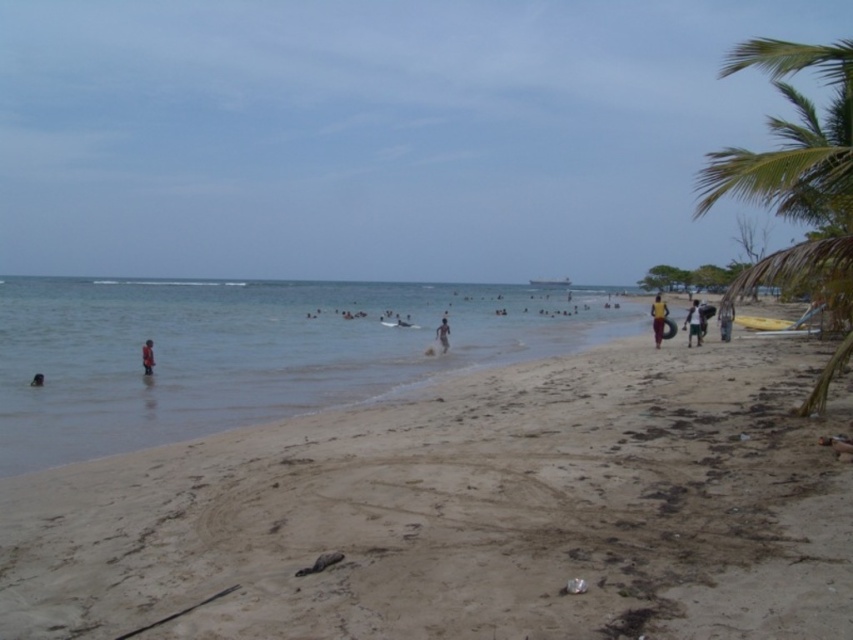
Question: Can you confirm if orange fabric person at lower left is smaller than dark skin human at lower left?

Choices:
 (A) yes
 (B) no

Answer: (B)

Question: Estimate the real-world distances between objects in this image. Which object is closer to the brown leather surfboard at lower right?

Choices:
 (A) orange fabric person at lower left
 (B) dark blue fabric shorts at center-right

Answer: (A)

Question: Which object is positioned closest to the orange fabric person at lower left?

Choices:
 (A) brown fabric person at right
 (B) green leafy palm tree at right
 (C) dark blue fabric shorts at center-right

Answer: (C)

Question: Estimate the real-world distances between objects in this image. Which object is farther from the dark skin human at lower left?

Choices:
 (A) green leafy palm tree at right
 (B) light brown sand at center
 (C) brown leather surfboard at lower right
 (D) clear blue water at beach center

Answer: (A)

Question: Where is brown sandy beach at lower left located in relation to light brown sand at center in the image?

Choices:
 (A) above
 (B) below

Answer: (B)

Question: Does brown leather surfboard at lower right have a smaller size compared to dark skin human at lower left?

Choices:
 (A) yes
 (B) no

Answer: (A)